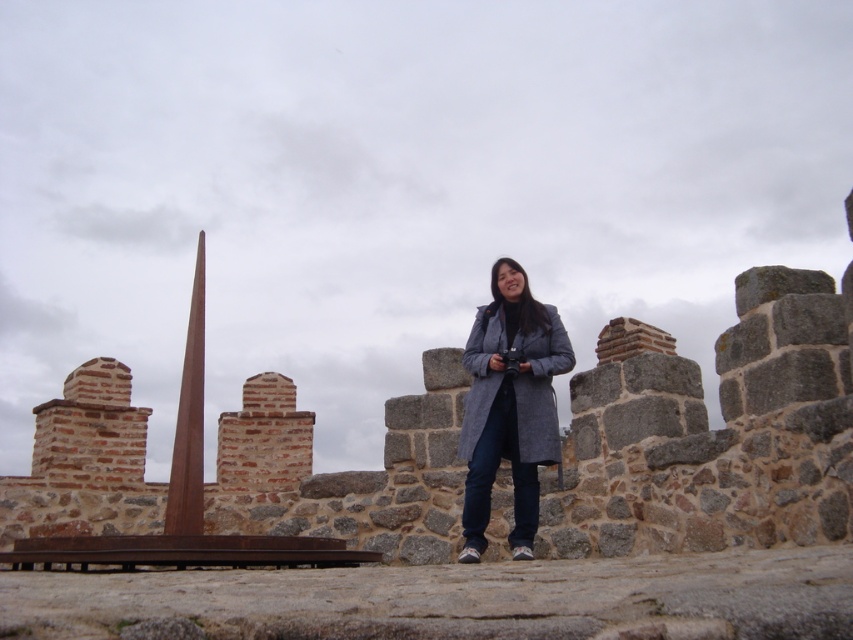
Question: Can you confirm if brown stone ruins at center is positioned below gray wool coat at center?

Choices:
 (A) yes
 (B) no

Answer: (B)

Question: Observing the image, what is the correct spatial positioning of brown stone ruins at center in reference to gray wool coat at center?

Choices:
 (A) left
 (B) right

Answer: (A)

Question: Does brown stone ruins at center come in front of gray wool coat at center?

Choices:
 (A) yes
 (B) no

Answer: (A)

Question: Which point is farther to the camera?

Choices:
 (A) gray wool coat at center
 (B) brown stone ruins at center

Answer: (A)

Question: Which point is farther to the camera?

Choices:
 (A) (521, 448)
 (B) (614, 520)

Answer: (A)